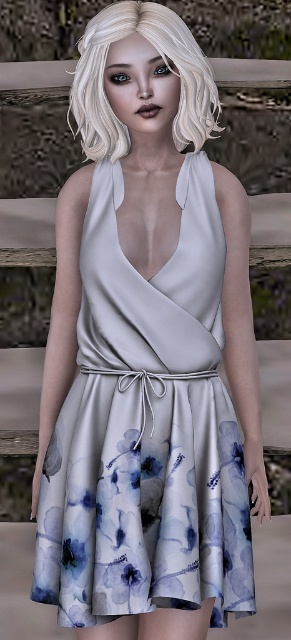
Question: Is the position of satin floral dress at center less distant than that of blonde silky hair at upper center?

Choices:
 (A) no
 (B) yes

Answer: (A)

Question: Does satin floral dress at center have a smaller size compared to blonde silky hair at upper center?

Choices:
 (A) yes
 (B) no

Answer: (B)

Question: Which point is farther from the camera taking this photo?

Choices:
 (A) (188, 64)
 (B) (192, 168)

Answer: (B)

Question: Is satin floral dress at center closer to the viewer compared to blonde silky hair at upper center?

Choices:
 (A) no
 (B) yes

Answer: (A)